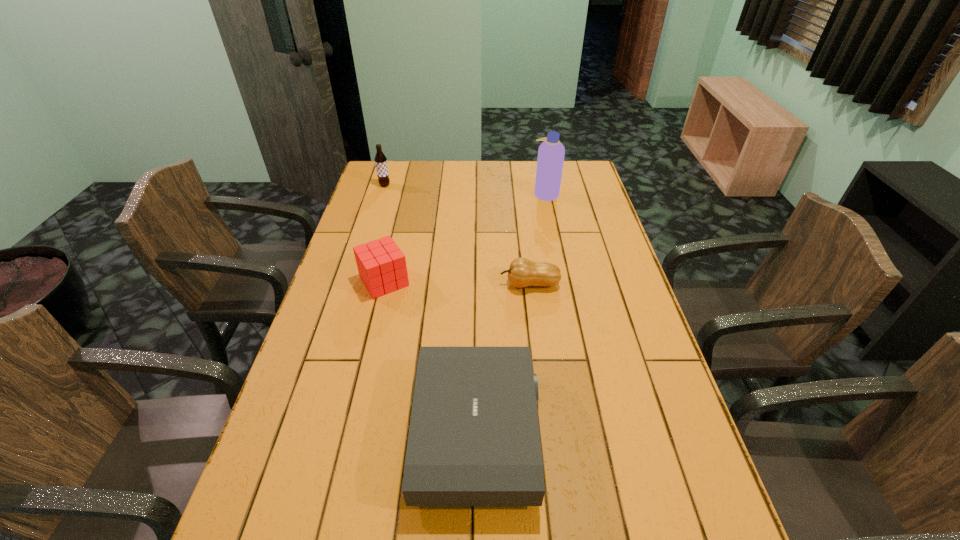
I want to click on free point at the left edge, so click(x=391, y=196).

Find the location of a particular element. vacant space at the right edge is located at coordinates [x=597, y=286].

Where is `free space between the projector and the tallest object`? The image size is (960, 540). free space between the projector and the tallest object is located at coordinates (512, 313).

The image size is (960, 540). I want to click on free spot between the nearest object and the shampoo, so click(x=512, y=313).

Where is `vacant area between the cube and the gourd`? The image size is (960, 540). vacant area between the cube and the gourd is located at coordinates (457, 282).

Identify the location of empty space between the tallest object and the nearest object. This screenshot has width=960, height=540. (512, 313).

Where is `vacant space in between the root beer and the nearest object`? vacant space in between the root beer and the nearest object is located at coordinates (431, 309).

Identify the location of free space that is in between the shortest object and the second tallest object. Image resolution: width=960 pixels, height=540 pixels. (457, 235).

This screenshot has width=960, height=540. In order to click on free point between the root beer and the tallest object in this screenshot , I will do `click(466, 190)`.

Where is `empty space that is in between the shampoo and the shortest object`? This screenshot has height=540, width=960. empty space that is in between the shampoo and the shortest object is located at coordinates (538, 239).